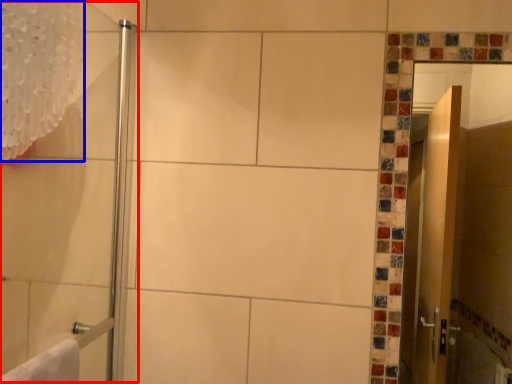
Question: Among these objects, which one is nearest to the camera, shower door (highlighted by a red box) or shower curtain (highlighted by a blue box)?

Choices:
 (A) shower door
 (B) shower curtain

Answer: (A)